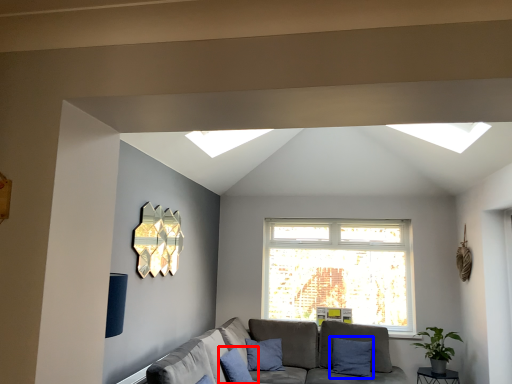
Question: Which object appears closest to the camera in this image, pillow (highlighted by a red box) or pillow (highlighted by a blue box)?

Choices:
 (A) pillow
 (B) pillow

Answer: (A)